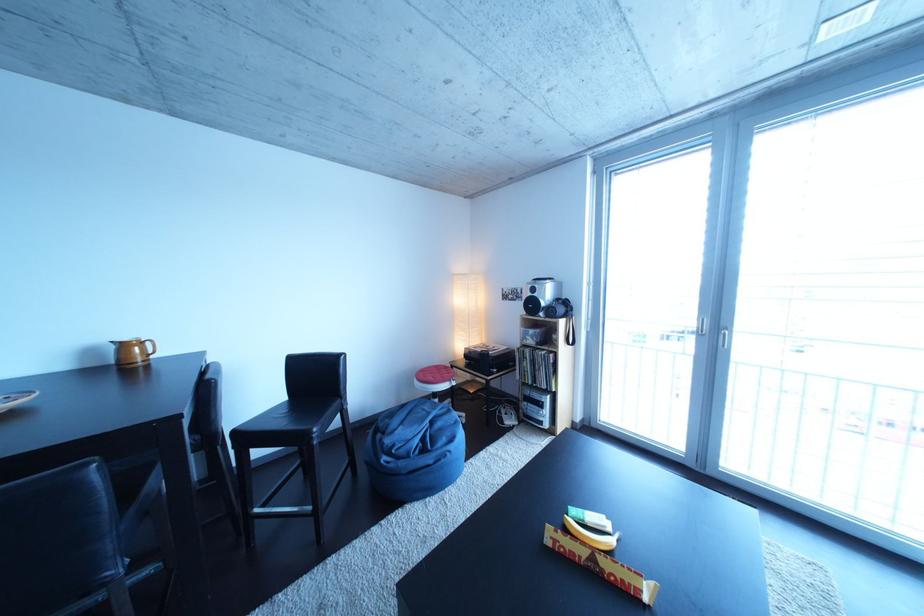
Image resolution: width=924 pixels, height=616 pixels. Describe the element at coordinates (432, 387) in the screenshot. I see `the red stool sitting surface` at that location.